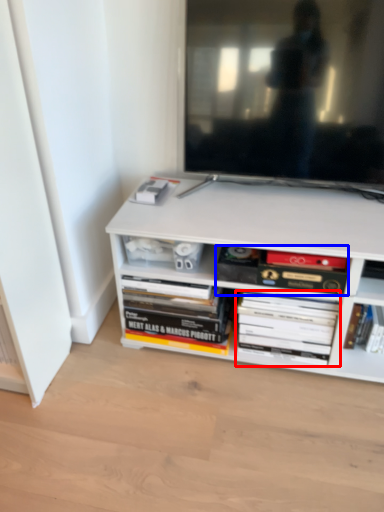
Question: Among these objects, which one is farthest to the camera, book (highlighted by a red box) or book (highlighted by a blue box)?

Choices:
 (A) book
 (B) book

Answer: (A)